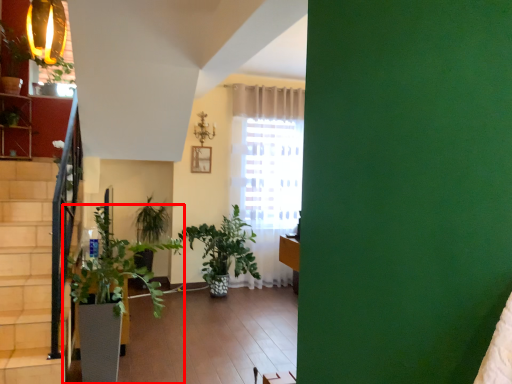
Question: From the image's perspective, where is houseplant (annotated by the red box) located relative to flowerpot?

Choices:
 (A) below
 (B) above

Answer: (B)